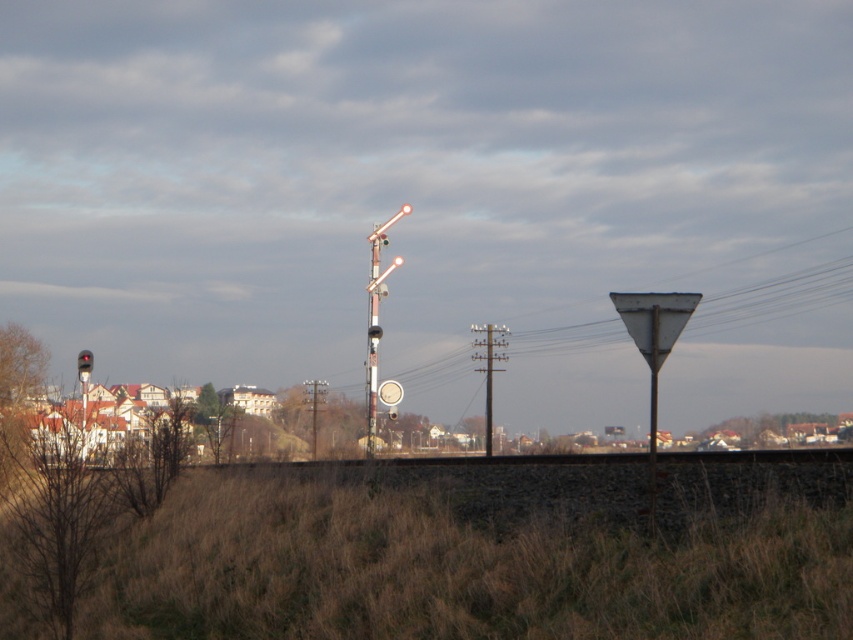
Consider the image. You are a train engineer approaching the railway crossing. You see the metallic signal pole at center and the metallic pole at center. Which one is closer to you?

The metallic signal pole at center is positioned over the metallic pole at center, so the metallic pole at center is closer to you.

You are a train engineer approaching the railway crossing. You see the metallic signal pole at center and the metallic pole at center. Which one is closer to you?

The metallic signal pole at center is closer to you because it is in front of the metallic pole at center.